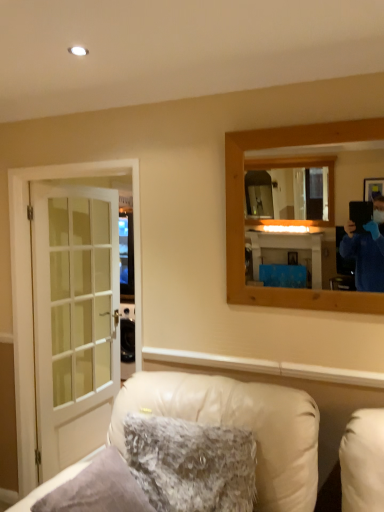
Question: Is white leather chair at lower center positioned with its back to fuzzy fabric pillow at lower center?

Choices:
 (A) yes
 (B) no

Answer: (A)

Question: Is white leather chair at lower center further to camera compared to fuzzy fabric pillow at lower center?

Choices:
 (A) no
 (B) yes

Answer: (A)

Question: From the image's perspective, does white leather chair at lower center appear lower than fuzzy fabric pillow at lower center?

Choices:
 (A) no
 (B) yes

Answer: (B)

Question: Can you confirm if white leather chair at lower center is shorter than fuzzy fabric pillow at lower center?

Choices:
 (A) no
 (B) yes

Answer: (A)

Question: Is white leather chair at lower center next to fuzzy fabric pillow at lower center and touching it?

Choices:
 (A) yes
 (B) no

Answer: (B)

Question: From the image's perspective, is white leather chair at lower center over fuzzy fabric pillow at lower center?

Choices:
 (A) no
 (B) yes

Answer: (A)

Question: From a real-world perspective, does fuzzy fabric pillow at lower center sit lower than wooden mirror at upper right?

Choices:
 (A) yes
 (B) no

Answer: (A)

Question: Considering the relative sizes of fuzzy fabric pillow at lower center and wooden mirror at upper right in the image provided, is fuzzy fabric pillow at lower center bigger than wooden mirror at upper right?

Choices:
 (A) yes
 (B) no

Answer: (A)

Question: Is fuzzy fabric pillow at lower center smaller than wooden mirror at upper right?

Choices:
 (A) no
 (B) yes

Answer: (A)

Question: From the image's perspective, is fuzzy fabric pillow at lower center on top of wooden mirror at upper right?

Choices:
 (A) yes
 (B) no

Answer: (B)

Question: Is the depth of fuzzy fabric pillow at lower center less than that of wooden mirror at upper right?

Choices:
 (A) yes
 (B) no

Answer: (A)

Question: Considering the relative positions of fuzzy fabric pillow at lower center and wooden mirror at upper right in the image provided, is fuzzy fabric pillow at lower center to the left of wooden mirror at upper right from the viewer's perspective?

Choices:
 (A) yes
 (B) no

Answer: (A)

Question: From the image's perspective, does fuzzy fabric pillow at lower center appear higher than white glass door at left?

Choices:
 (A) yes
 (B) no

Answer: (B)